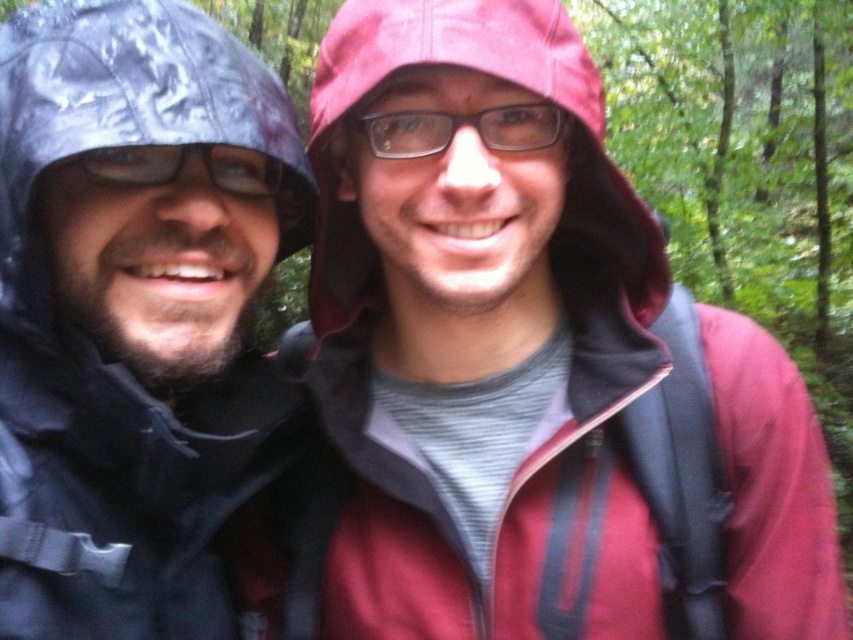
Is matte black jacket at left wider than clear plastic glasses at center?

Yes.

Between matte black jacket at left and clear plastic glasses at center, which one has more height?

With more height is matte black jacket at left.

Is point (186, 36) less distant than point (508, 128)?

Yes, point (186, 36) is closer to viewer.

What are the coordinates of `matte black jacket at left` in the screenshot? It's located at (132, 310).